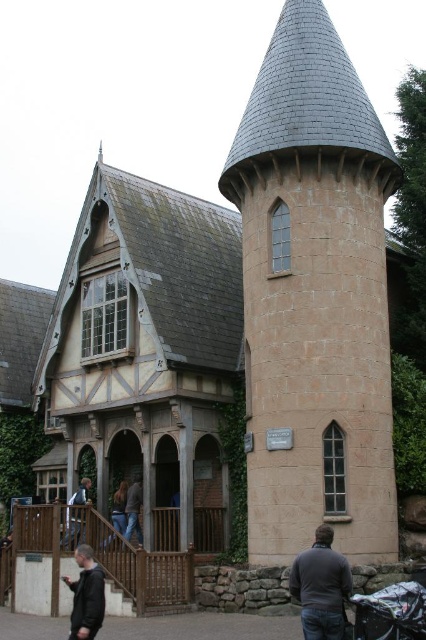
How much distance is there between dark gray sweater at lower center and light brown wooden chair at lower center?

dark gray sweater at lower center is 26.37 meters from light brown wooden chair at lower center.

Which of these two, dark gray sweater at lower center or light brown wooden chair at lower center, stands shorter?

dark gray sweater at lower center

Who is more forward, (322, 584) or (77, 540)?

Point (322, 584) is in front.

Identify the location of dark gray sweater at lower center. This screenshot has height=640, width=426. (321, 586).

Does beige stone tower at right have a lesser height compared to black fabric baby carriage at lower right?

No.

Does point (330, 468) come in front of point (377, 637)?

No, it is not.

Between point (287, 152) and point (394, 600), which one is positioned in front?

Point (394, 600) is more forward.

Locate an element on the screen. beige stone tower at right is located at coordinates (314, 296).

Is beige stone tower at right smaller than light brown wooden chair at lower center?

Incorrect, beige stone tower at right is not smaller in size than light brown wooden chair at lower center.

Between point (313, 467) and point (77, 541), which one is positioned in front?

Point (313, 467) is more forward.

Locate an element on the screen. This screenshot has height=640, width=426. beige stone tower at right is located at coordinates (314, 296).